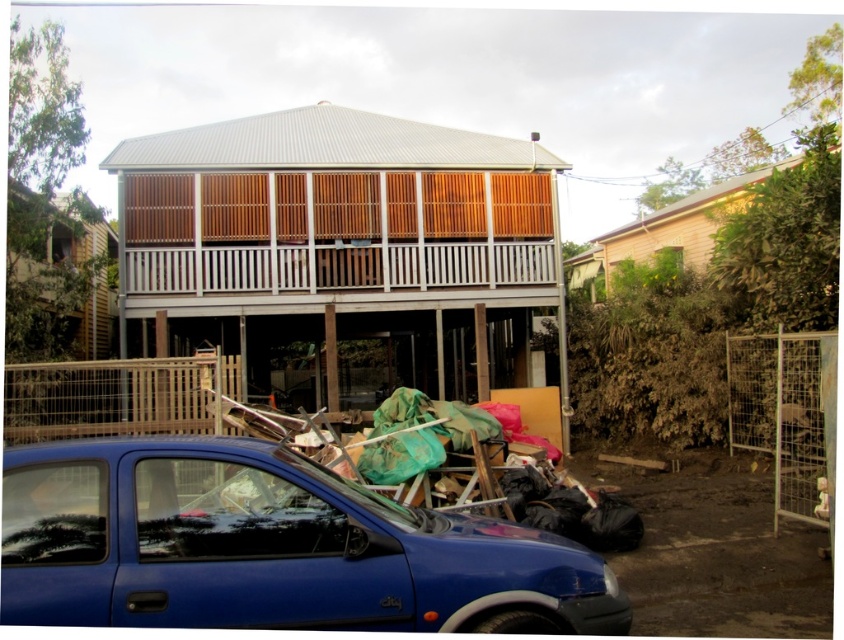
Does blue matte car at lower left have a greater height compared to green fabric at lower center?

No, blue matte car at lower left is not taller than green fabric at lower center.

Find the location of a particular element. blue matte car at lower left is located at coordinates (269, 547).